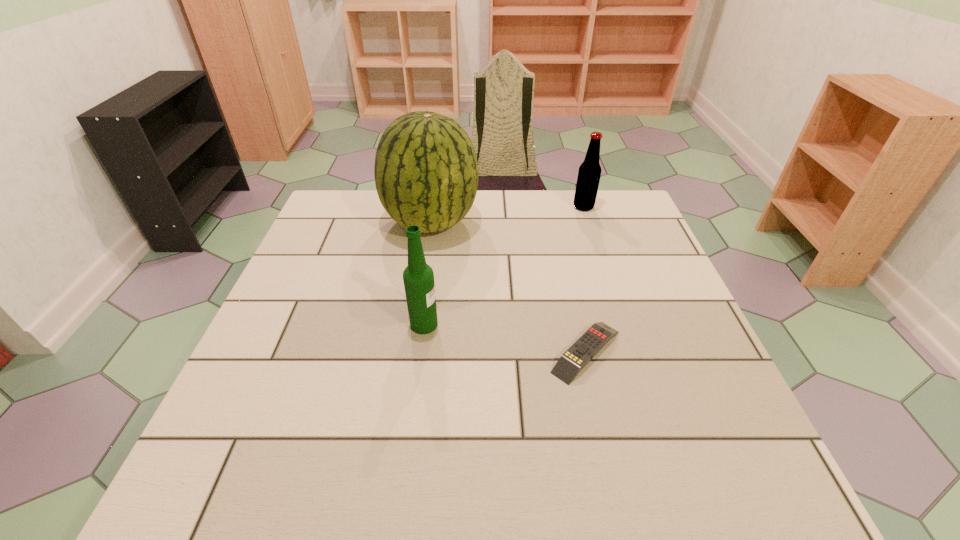
Where is `vacant area in the image that satisfies the following two spatial constraints: 1. on the front side of the right beer bottle; 2. on the label of the left beer bottle`? The image size is (960, 540). vacant area in the image that satisfies the following two spatial constraints: 1. on the front side of the right beer bottle; 2. on the label of the left beer bottle is located at coordinates (622, 324).